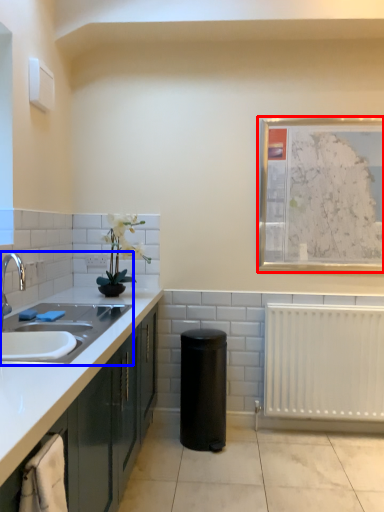
Question: Which of the following is the farthest to the observer, picture frame (highlighted by a red box) or sink (highlighted by a blue box)?

Choices:
 (A) picture frame
 (B) sink

Answer: (A)